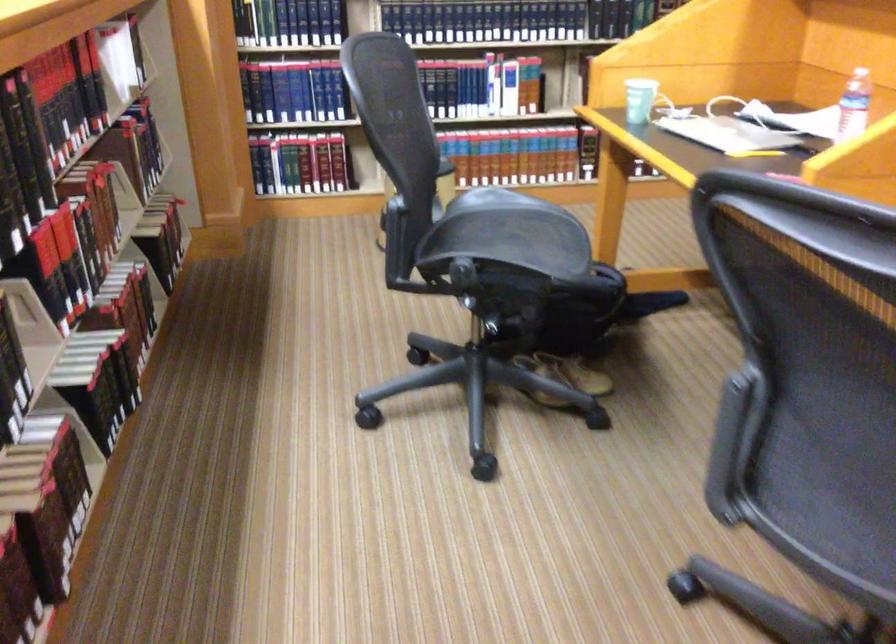
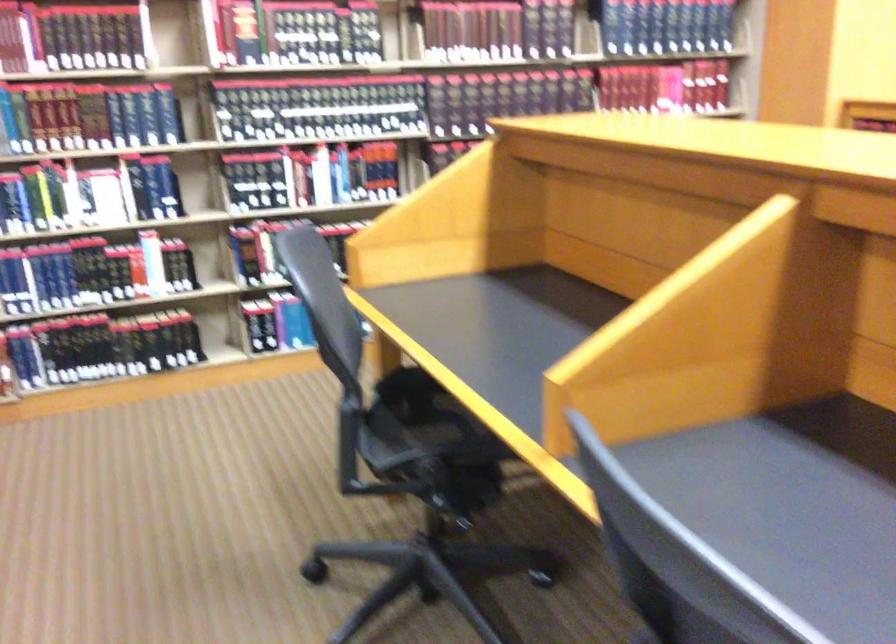
Question: The images are taken continuously from a first-person perspective. In which direction are you moving?

Choices:
 (A) Left
 (B) Right
 (C) Forward
 (D) Backward

Answer: (B)